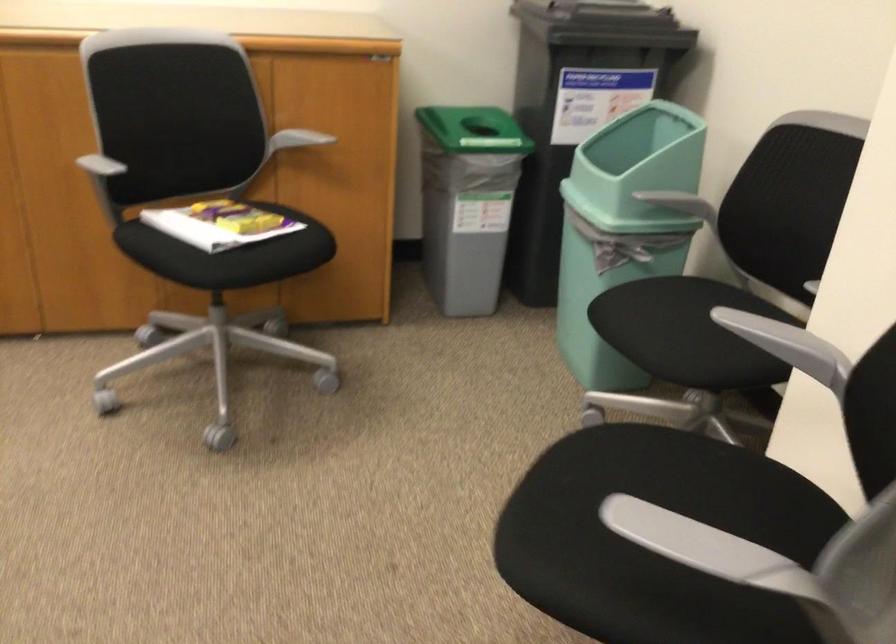
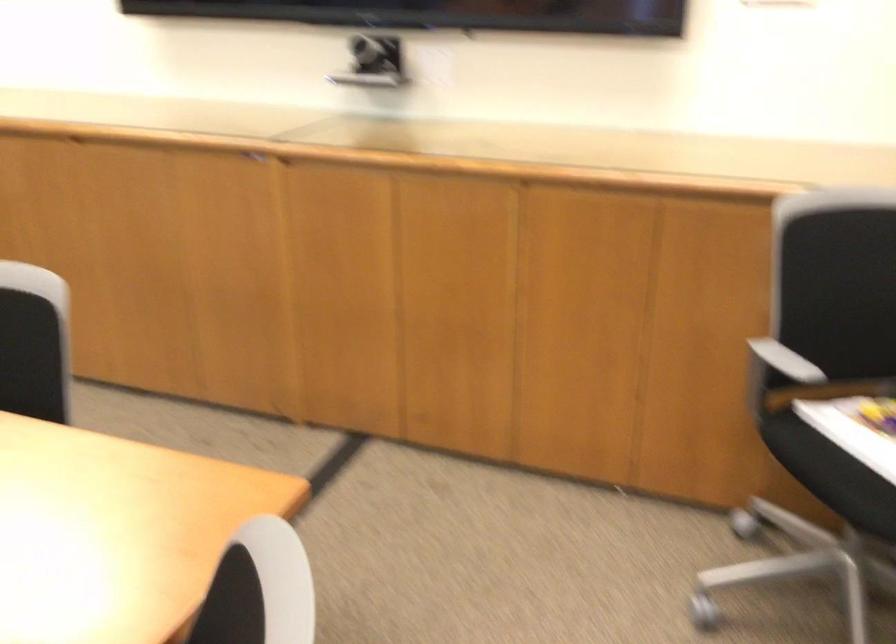
Where in the second image is the point corresponding to (108,174) from the first image?

(778, 374)